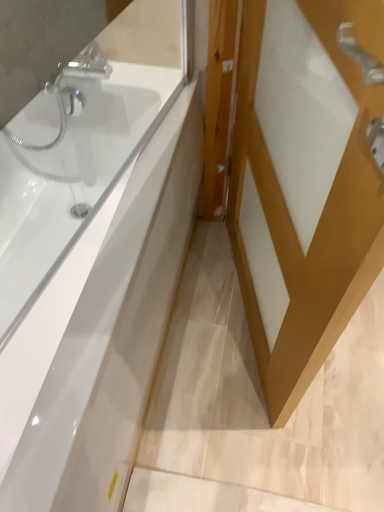
Question: Considering the relative sizes of white matte door at center and white glossy bathtub at upper left in the image provided, is white matte door at center thinner than white glossy bathtub at upper left?

Choices:
 (A) yes
 (B) no

Answer: (A)

Question: Is white matte door at center touching white glossy bathtub at upper left?

Choices:
 (A) no
 (B) yes

Answer: (A)

Question: From a real-world perspective, is white matte door at center on white glossy bathtub at upper left?

Choices:
 (A) yes
 (B) no

Answer: (A)

Question: Considering the relative sizes of white matte door at center and white glossy bathtub at upper left in the image provided, is white matte door at center smaller than white glossy bathtub at upper left?

Choices:
 (A) yes
 (B) no

Answer: (A)

Question: Can you confirm if white matte door at center is bigger than white glossy bathtub at upper left?

Choices:
 (A) no
 (B) yes

Answer: (A)

Question: Could white glossy bathtub at upper left be considered to be inside white matte door at center?

Choices:
 (A) yes
 (B) no

Answer: (B)

Question: Considering the relative sizes of white glossy bathtub at upper left and white matte door at center in the image provided, is white glossy bathtub at upper left smaller than white matte door at center?

Choices:
 (A) no
 (B) yes

Answer: (A)

Question: Is white glossy bathtub at upper left beside white matte door at center?

Choices:
 (A) no
 (B) yes

Answer: (A)

Question: From a real-world perspective, is white glossy bathtub at upper left beneath white matte door at center?

Choices:
 (A) yes
 (B) no

Answer: (A)

Question: From the image's perspective, is white glossy bathtub at upper left located above white matte door at center?

Choices:
 (A) yes
 (B) no

Answer: (B)

Question: Does white glossy bathtub at upper left have a lesser height compared to white matte door at center?

Choices:
 (A) no
 (B) yes

Answer: (B)

Question: Can we say white glossy bathtub at upper left lies outside white matte door at center?

Choices:
 (A) yes
 (B) no

Answer: (A)

Question: Is point (332, 241) positioned closer to the camera than point (69, 88)?

Choices:
 (A) closer
 (B) farther

Answer: (A)